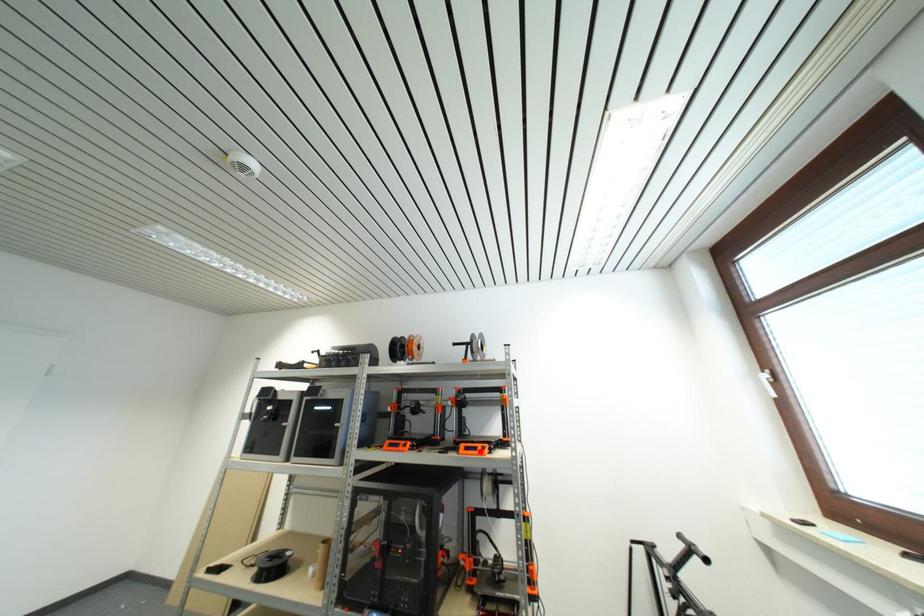
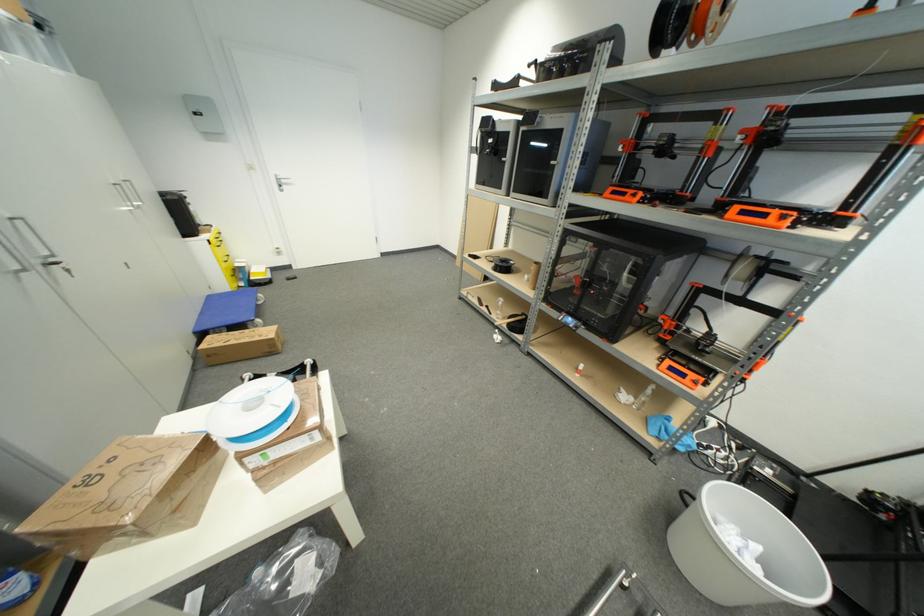
The point at the highlighted location is marked in the first image. Where is the corresponding point in the second image?

(769, 217)